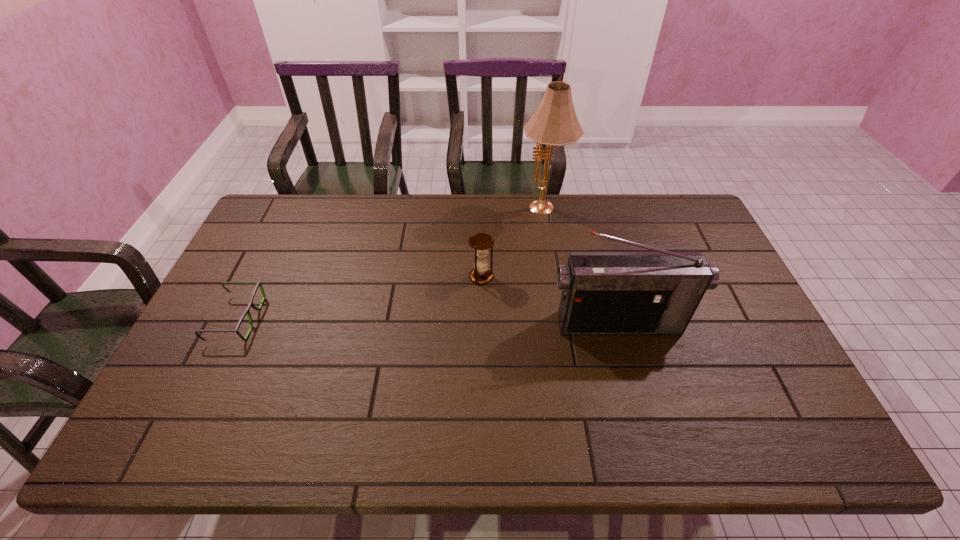
I want to click on vacant region located on the lens of the shortest object, so click(318, 319).

Image resolution: width=960 pixels, height=540 pixels. What are the coordinates of `object at the far edge` in the screenshot? It's located at pos(554,123).

Where is `object that is positioned at the left edge`? This screenshot has width=960, height=540. object that is positioned at the left edge is located at coordinates (251, 304).

Identify the location of free space at the far edge of the desktop. This screenshot has width=960, height=540. (648, 232).

The image size is (960, 540). In order to click on free space at the left edge of the desktop in this screenshot , I will do `click(201, 394)`.

The width and height of the screenshot is (960, 540). In the image, there is a desktop. What are the coordinates of `vacant space at the far left corner` in the screenshot? It's located at (279, 218).

Locate an element on the screen. This screenshot has width=960, height=540. vacant region at the near left corner of the desktop is located at coordinates (143, 432).

Locate an element on the screen. free space between the tallest object and the third nearest object is located at coordinates (513, 244).

The width and height of the screenshot is (960, 540). Find the location of `blank region between the radio receiver and the hourglass`. blank region between the radio receiver and the hourglass is located at coordinates tap(550, 300).

What are the coordinates of `free space between the second tallest object and the spectacles` in the screenshot? It's located at pyautogui.click(x=427, y=321).